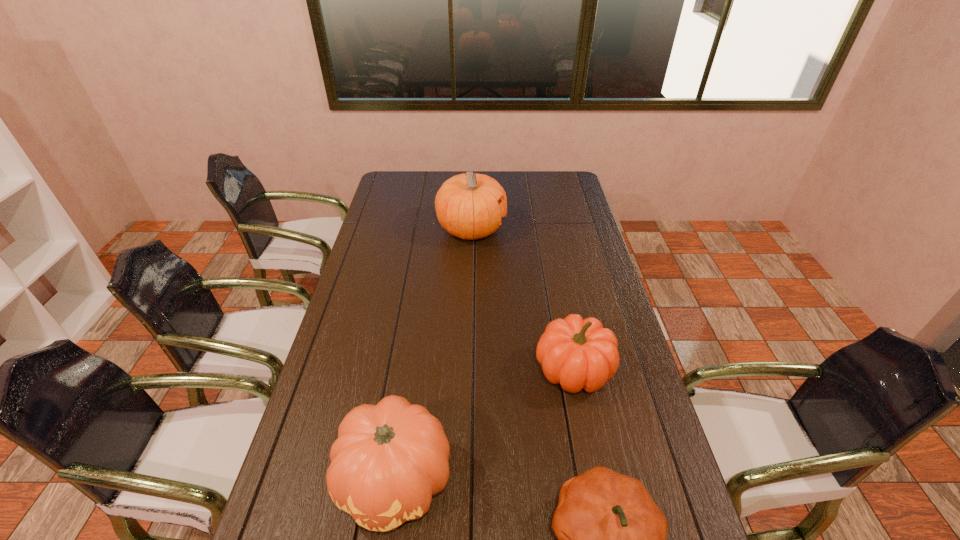
What are the coordinates of `the tallest pumpkin` in the screenshot? It's located at (467, 205).

Image resolution: width=960 pixels, height=540 pixels. What are the coordinates of `the farthest object` in the screenshot? It's located at (467, 205).

Where is `the second farthest pumpkin`? The width and height of the screenshot is (960, 540). the second farthest pumpkin is located at coordinates (576, 353).

This screenshot has width=960, height=540. Identify the location of vacant space situated 0.320m on the front-facing side of the farthest pumpkin. (583, 230).

Identify the location of vacant space positioned on the left of the second farthest object. Image resolution: width=960 pixels, height=540 pixels. (429, 369).

Where is `object positioned at the right edge`? The image size is (960, 540). object positioned at the right edge is located at coordinates (576, 353).

Locate an element on the screen. free space at the far edge of the desktop is located at coordinates pyautogui.click(x=522, y=173).

You are a GUI agent. You are given a task and a screenshot of the screen. Output one action in this format:
    pyautogui.click(x=<x>, y=<y>)
    Task: Click on the free location at the left edge of the desktop
    
    Given the screenshot: What is the action you would take?
    pyautogui.click(x=388, y=212)

Find the location of a particular element. vacant space at the right edge of the desktop is located at coordinates (612, 317).

You are a GUI agent. You are given a task and a screenshot of the screen. Output one action in this format:
    pyautogui.click(x=<x>, y=<y>)
    Task: Click on the free space that is in between the third nearest pumpkin and the tallest pumpkin
    Image resolution: width=960 pixels, height=540 pixels.
    Given the screenshot: What is the action you would take?
    pyautogui.click(x=522, y=299)